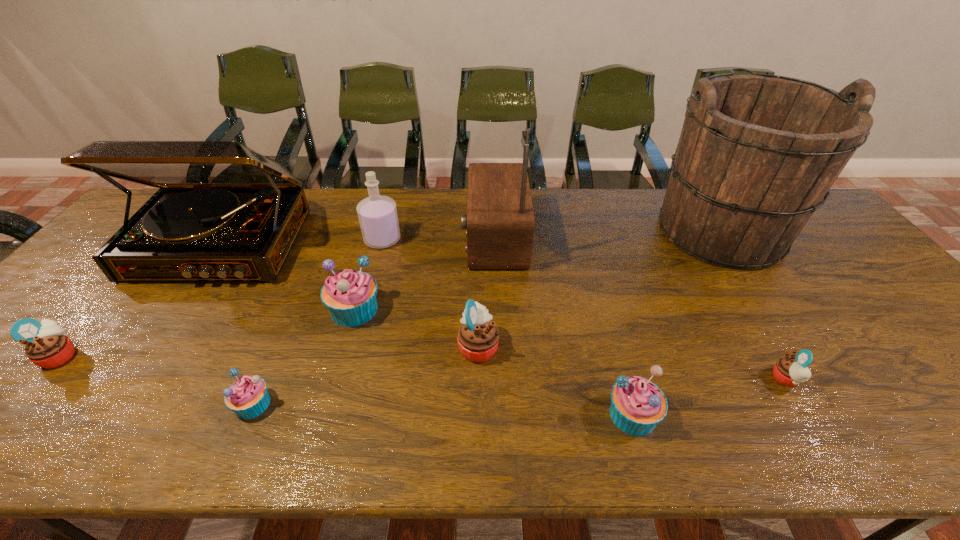
I want to click on bucket, so click(x=757, y=153).

Image resolution: width=960 pixels, height=540 pixels. I want to click on radio receiver, so click(500, 221).

You are a GUI agent. You are given a task and a screenshot of the screen. Output one action in this format:
    pyautogui.click(x=<x>, y=<y>)
    Task: Click on the record player
    Image resolution: width=960 pixels, height=540 pixels.
    Given the screenshot: What is the action you would take?
    pyautogui.click(x=224, y=212)

Identify the location of perfume. (377, 214).

Locate an element on the screen. The image size is (960, 540). purple perfume is located at coordinates (377, 214).

Where is `the fourth muffin from right to left`? the fourth muffin from right to left is located at coordinates (350, 296).

Where is `the biggest blue muffin`? The height and width of the screenshot is (540, 960). the biggest blue muffin is located at coordinates (350, 296).

Image resolution: width=960 pixels, height=540 pixels. In order to click on the second pink muffin from right to left in this screenshot , I will do `click(478, 337)`.

The height and width of the screenshot is (540, 960). Find the location of `the biggest pink muffin`. the biggest pink muffin is located at coordinates (478, 337).

Locate an element on the screen. the leftmost pink muffin is located at coordinates (47, 345).